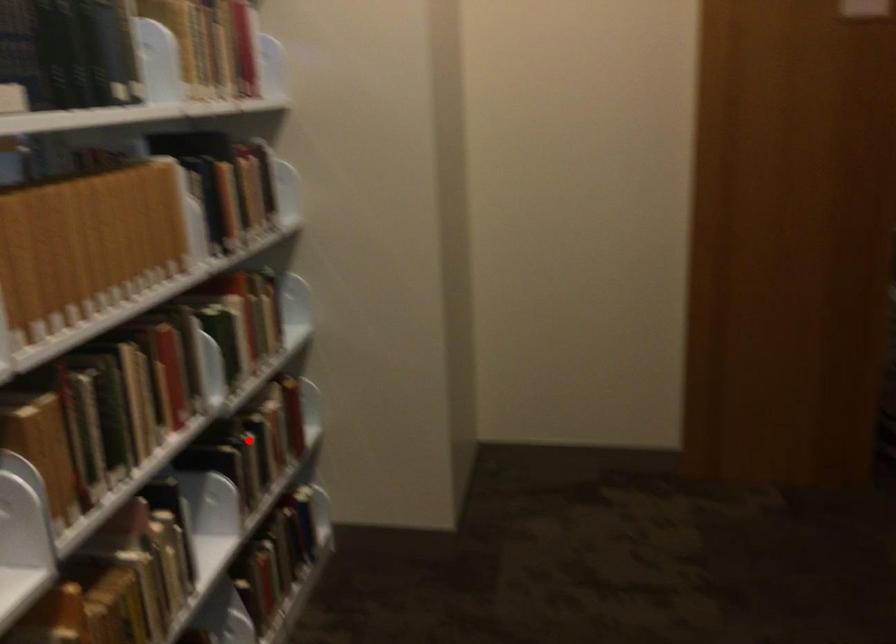
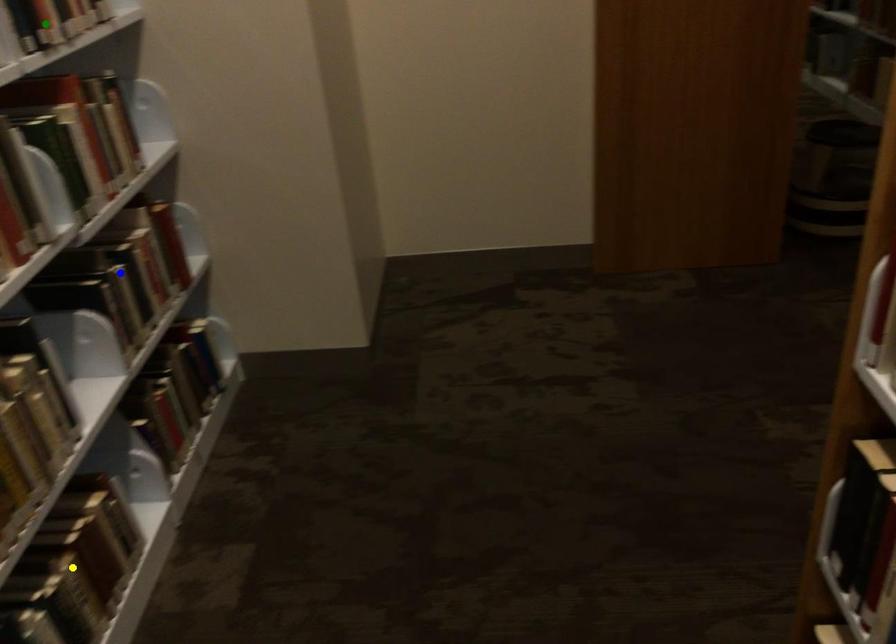
Question: I am providing you with two images of the same scene from different viewpoints. A red point is marked on the first image. You are given multiple points on the second image. Which point in image 2 is actually the same real-world point as the red point in image 1?

Choices:
 (A) blue point
 (B) yellow point
 (C) green point

Answer: (A)